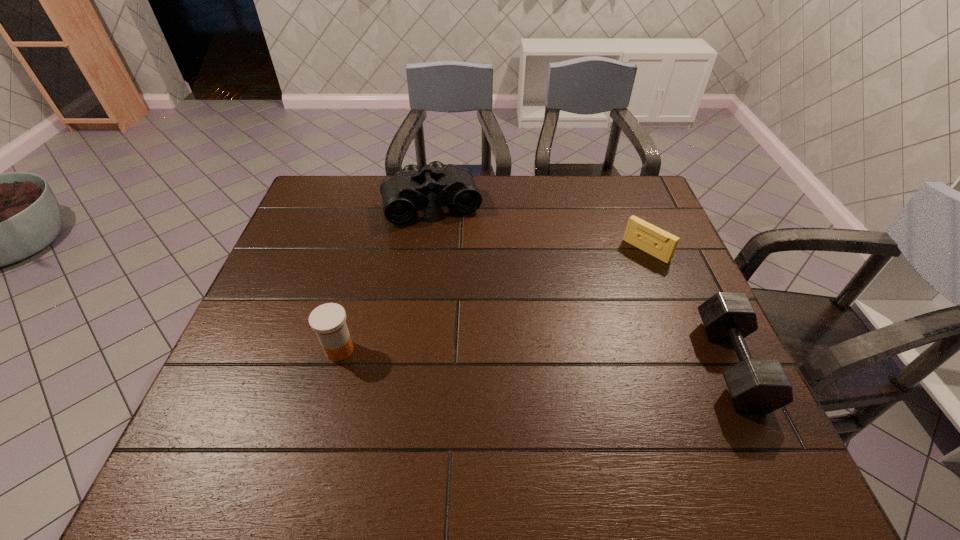
You are a GUI agent. You are given a task and a screenshot of the screen. Output one action in this format:
    pyautogui.click(x=<x>, y=<y>)
    Task: Click on the free space on the desktop that is between the medicine and the dumbbell and is positioned at the eyepieces of the binoculars
    
    Given the screenshot: What is the action you would take?
    pyautogui.click(x=480, y=355)

The width and height of the screenshot is (960, 540). I want to click on vacant space on the desktop that is between the medicine and the dumbbell and is positioned at the front of the videotape with spools, so [526, 357].